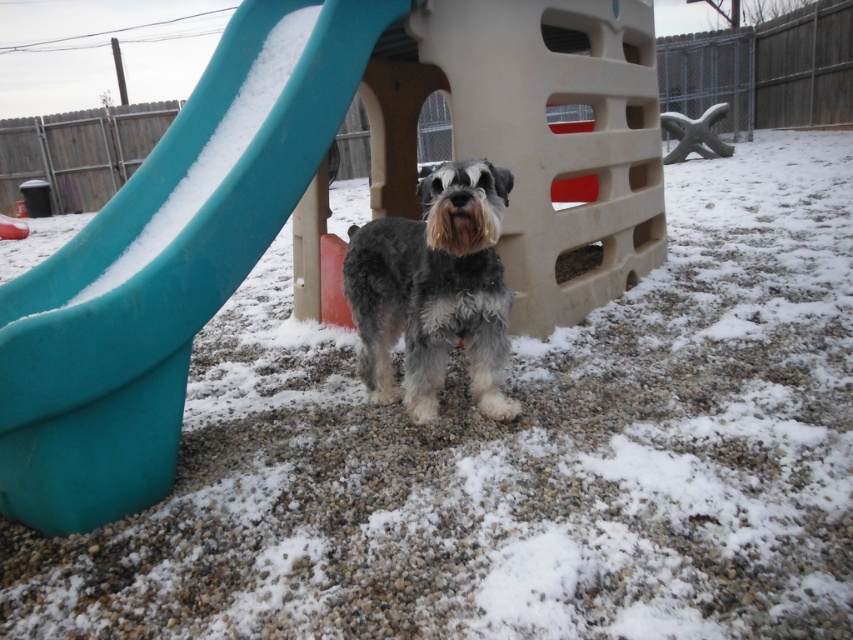
You are a child trying to reach the slide from where you are standing. Which object is closer to you, the teal plastic slide at left or the gray shaggy dog at center?

The teal plastic slide at left is closer to the viewer than the gray shaggy dog at center, so the slide is closer.

You are a parent trying to decide if your child can safely climb the teal plastic slide at left while the gray shaggy dog at center is nearby. Considering the height difference between them, is the slide taller than the dog?

The teal plastic slide at left is much taller than the gray shaggy dog at center, so the slide is taller than the dog. Therefore, the child can safely climb the slide as it is much taller than the dog.

You are standing at the center of the image and want to locate the teal plastic slide at left. According to the coordinates provided, in which direction should you look to find it?

The teal plastic slide at left is located at coordinates point (x=166, y=266), so you should look to the left side of the image to find it.